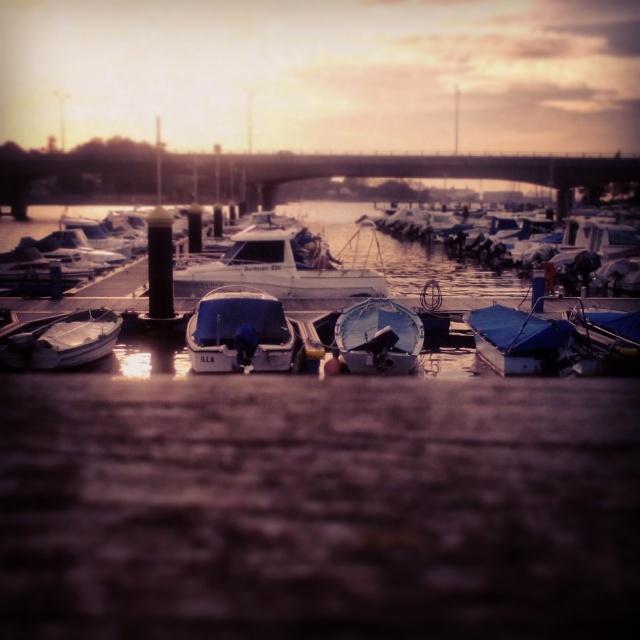
Question: Based on their relative distances, which object is farther from the shiny blue tarpaulin boat at center?

Choices:
 (A) white matte boat at center
 (B) blue tarpaulin boat at center

Answer: (A)

Question: Is white matte boat at left above shiny blue tarpaulin boat at center?

Choices:
 (A) no
 (B) yes

Answer: (A)

Question: Which object appears farthest from the camera in this image?

Choices:
 (A) white matte boat at left
 (B) shiny blue tarpaulin boat at center
 (C) blue tarpaulin boat at center
 (D) white matte boat at center

Answer: (D)

Question: Does blue tarp-covered boat at center appear on the right side of shiny blue tarpaulin boat at center?

Choices:
 (A) no
 (B) yes

Answer: (A)

Question: Estimate the real-world distances between objects in this image. Which object is closer to the white matte boat at left?

Choices:
 (A) shiny blue tarpaulin boat at center
 (B) white matte boat at center
 (C) blue tarp-covered boat at center

Answer: (C)

Question: Is blue tarpaulin boat at center below white matte boat at left?

Choices:
 (A) no
 (B) yes

Answer: (B)